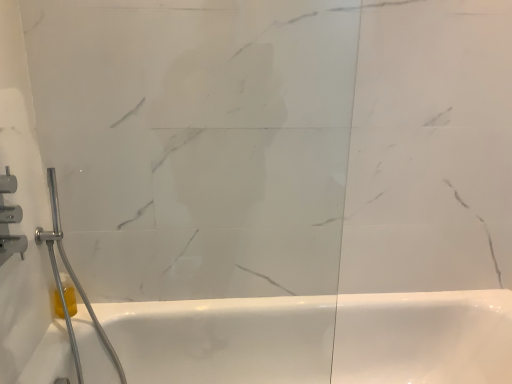
Question: Are transparent glass door at center and brushed metal shower at left, positioned as the 2th shower in back-to-front order, far apart?

Choices:
 (A) yes
 (B) no

Answer: (B)

Question: From the image's perspective, does transparent glass door at center appear higher than brushed metal shower at left, positioned as the 2th shower in back-to-front order?

Choices:
 (A) no
 (B) yes

Answer: (A)

Question: Considering the relative sizes of transparent glass door at center and brushed metal shower at left, the 1th shower from the front, in the image provided, is transparent glass door at center wider than brushed metal shower at left, the 1th shower from the front,?

Choices:
 (A) no
 (B) yes

Answer: (B)

Question: Could you tell me if transparent glass door at center is facing brushed metal shower at left, positioned as the 2th shower in back-to-front order?

Choices:
 (A) yes
 (B) no

Answer: (B)

Question: Could brushed metal shower at left, the 1th shower from the front, be considered to be inside transparent glass door at center?

Choices:
 (A) no
 (B) yes

Answer: (A)

Question: Based on their sizes in the image, would you say brushed metal shower at left, which is the second shower in front-to-back order, is bigger or smaller than yellow translucent soap at lower left?

Choices:
 (A) small
 (B) big

Answer: (B)

Question: In the image, is brushed metal shower at left, which is the second shower in front-to-back order, positioned in front of or behind yellow translucent soap at lower left?

Choices:
 (A) behind
 (B) front

Answer: (B)

Question: Is brushed metal shower at left, which appears as the first shower when viewed from the back, inside or outside of yellow translucent soap at lower left?

Choices:
 (A) inside
 (B) outside

Answer: (B)

Question: Is brushed metal shower at left, which appears as the first shower when viewed from the back, to the left or to the right of yellow translucent soap at lower left in the image?

Choices:
 (A) left
 (B) right

Answer: (B)

Question: Would you say transparent glass door at center is to the left or to the right of brushed metal shower at left, positioned as the 2th shower in back-to-front order, in the picture?

Choices:
 (A) left
 (B) right

Answer: (B)

Question: Considering the positions of transparent glass door at center and brushed metal shower at left, positioned as the 2th shower in back-to-front order, in the image, is transparent glass door at center wider or thinner than brushed metal shower at left, positioned as the 2th shower in back-to-front order,?

Choices:
 (A) thin
 (B) wide

Answer: (B)

Question: Relative to brushed metal shower at left, positioned as the 2th shower in back-to-front order, is transparent glass door at center in front or behind?

Choices:
 (A) behind
 (B) front

Answer: (B)

Question: Is transparent glass door at center taller or shorter than brushed metal shower at left, the 1th shower from the front?

Choices:
 (A) tall
 (B) short

Answer: (A)

Question: Is brushed metal shower at left, positioned as the 2th shower in back-to-front order, taller or shorter than yellow translucent soap at lower left?

Choices:
 (A) tall
 (B) short

Answer: (A)

Question: In terms of size, does brushed metal shower at left, the 1th shower from the front, appear bigger or smaller than yellow translucent soap at lower left?

Choices:
 (A) small
 (B) big

Answer: (B)